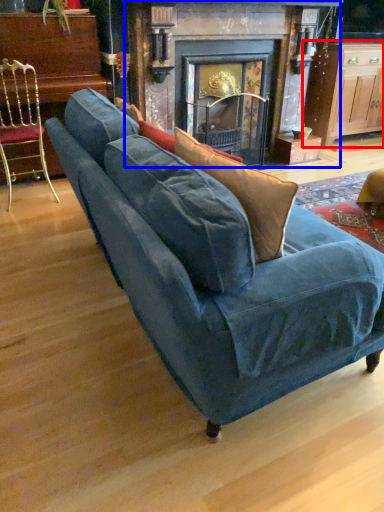
Question: Which point is further to the camera, table (highlighted by a red box) or fireplace (highlighted by a blue box)?

Choices:
 (A) table
 (B) fireplace

Answer: (A)